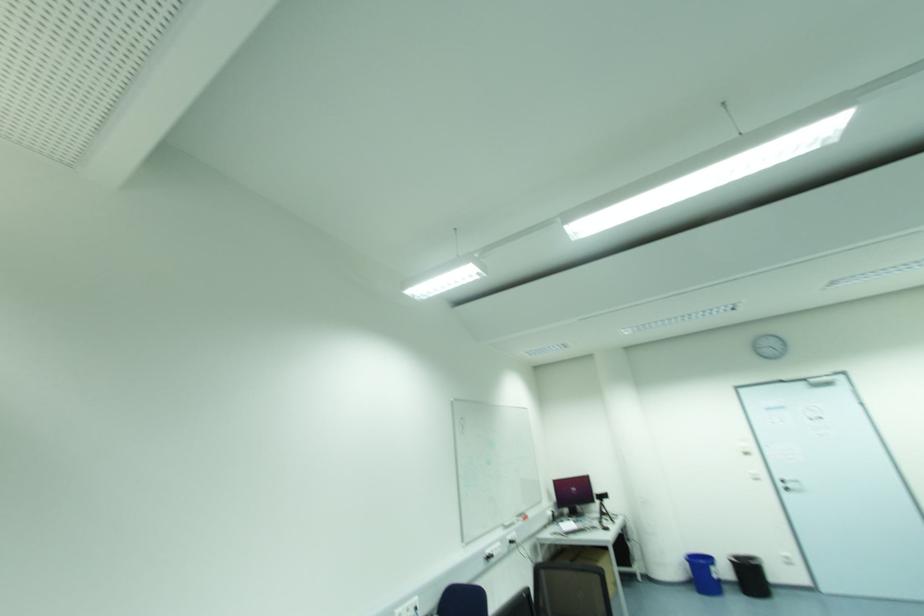
Locate an element on the screen. white door handle is located at coordinates (789, 484).